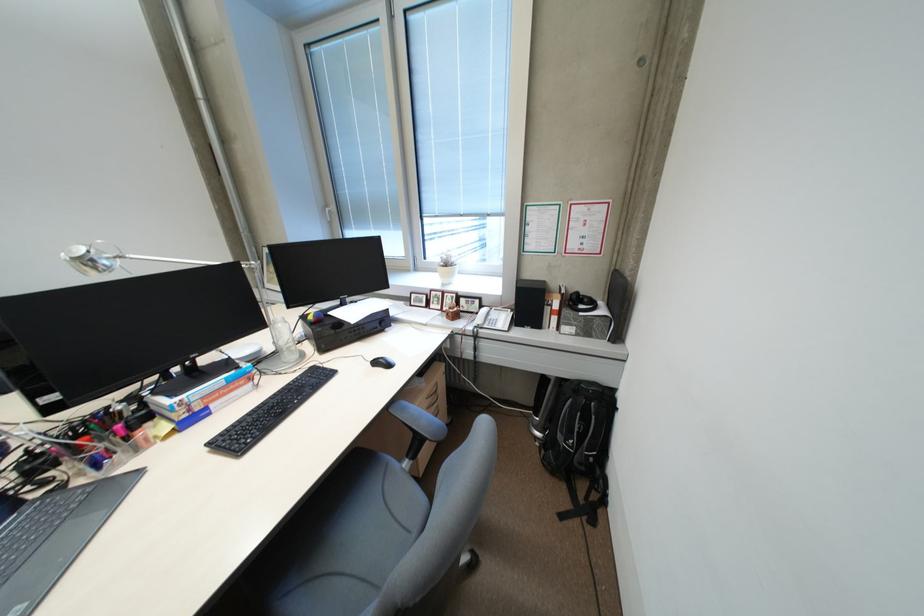
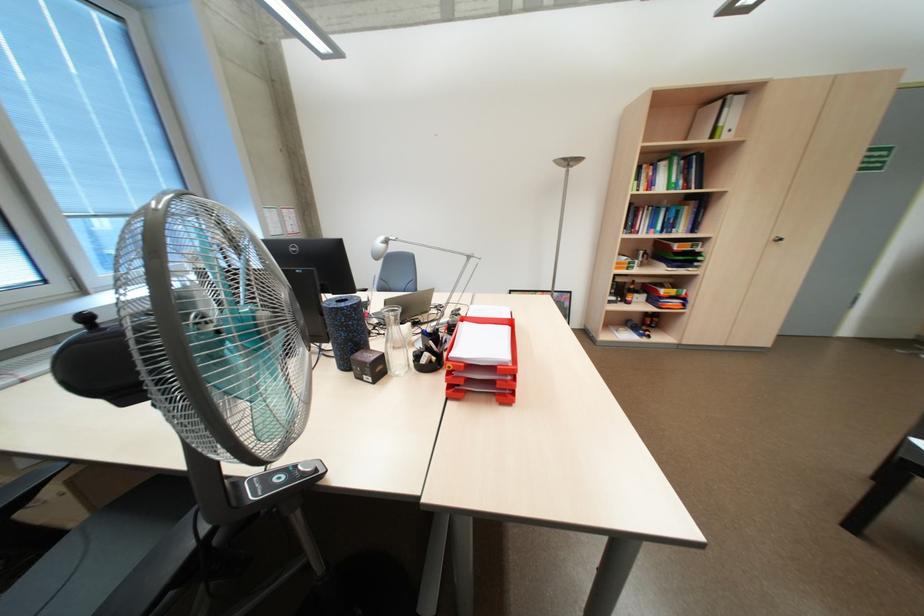
Question: I am providing you with two images of the same scene from different viewpoints. After the viewpoint changes to image2, which objects are now occluded?

Choices:
 (A) red paper tray
 (B) brown cabinet knob
 (C) pen in holder
 (D) chair sitting surface

Answer: (D)